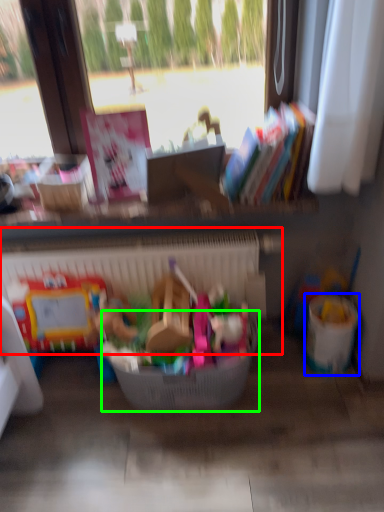
Question: Considering the real-world distances, which object is closest to radiator (highlighted by a red box)? recycling bin (highlighted by a blue box) or basket (highlighted by a green box).

Choices:
 (A) recycling bin
 (B) basket

Answer: (B)